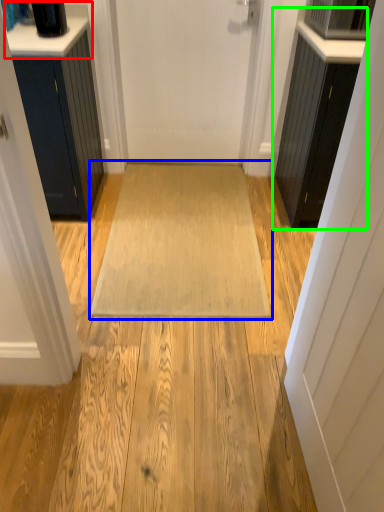
Question: Which is nearer to the counter top (highlighted by a red box)? doormat (highlighted by a blue box) or cabinetry (highlighted by a green box).

Choices:
 (A) doormat
 (B) cabinetry

Answer: (A)